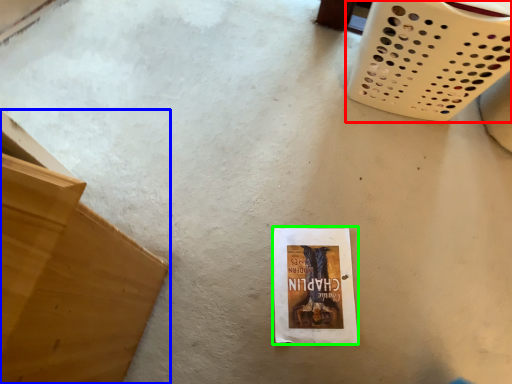
Question: Considering the real-world distances, which object is farthest from basket (highlighted by a red box)? furniture (highlighted by a blue box) or paperback book (highlighted by a green box)?

Choices:
 (A) furniture
 (B) paperback book

Answer: (A)